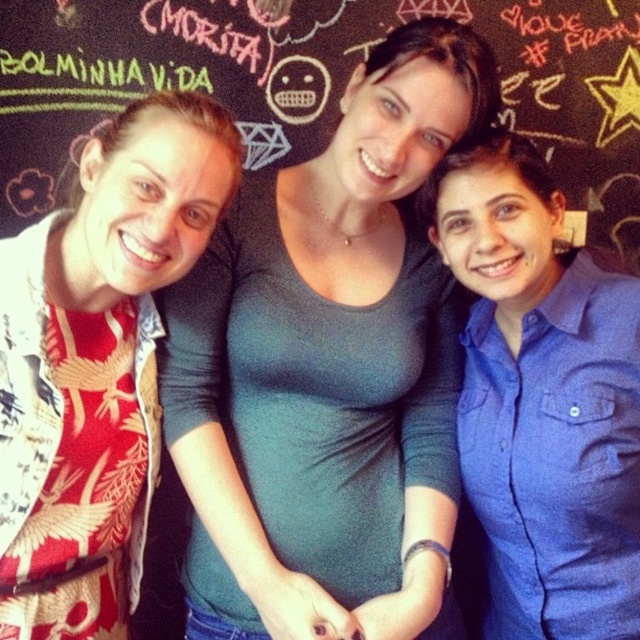
From the picture: Can you confirm if green matte shirt at center is bigger than black chalkboard at center?

Yes.

Does point (401, 296) come farther from viewer compared to point (122, 106)?

That is False.

Who is more distant from viewer, (x=316, y=497) or (x=588, y=76)?

The point (x=588, y=76) is behind.

Locate an element on the screen. The width and height of the screenshot is (640, 640). green matte shirt at center is located at coordinates (330, 371).

Does printed silk blouse at left have a smaller size compared to blue cotton shirt at center?

Correct, printed silk blouse at left occupies less space than blue cotton shirt at center.

Locate an element on the screen. printed silk blouse at left is located at coordinates (99, 362).

Is printed silk blouse at left smaller than black chalkboard at center?

Correct, printed silk blouse at left occupies less space than black chalkboard at center.

Which is in front, point (13, 586) or point (24, 120)?

Point (13, 586) is more forward.

The width and height of the screenshot is (640, 640). What do you see at coordinates (99, 362) in the screenshot? I see `printed silk blouse at left` at bounding box center [99, 362].

Find the location of a particular element. This screenshot has height=640, width=640. printed silk blouse at left is located at coordinates (99, 362).